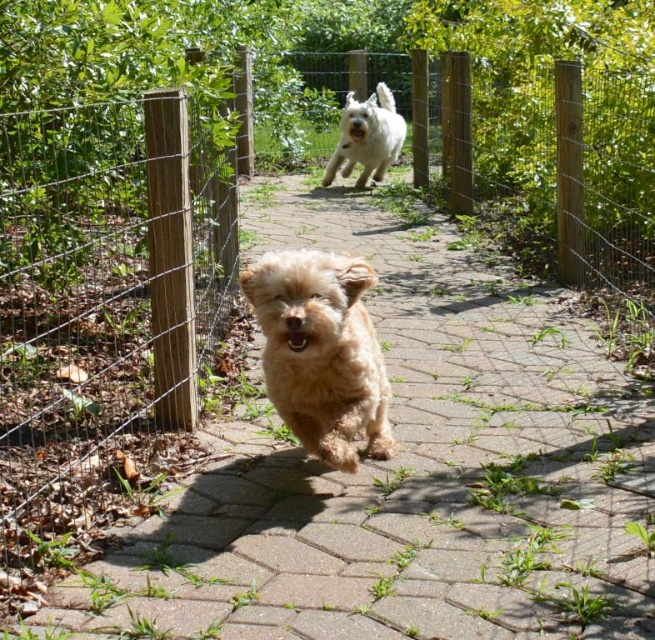
You are standing on the pathway and want to walk from point (117, 456) to point (291, 387). Which direction should you face to move towards the latter point?

To move from point (117, 456) to point (291, 387), you should face towards the background since point (291, 387) is further away from the viewer compared to point (117, 456).

You are a photographer trying to capture a photo of the brown brick path at center and the fuzzy golden dog at center. Based on their positions, which object appears closer to the camera in the image?

The brown brick path at center appears closer to the camera because it is much taller than the fuzzy golden dog at center in the image.

You are a photographer setting up a tripod in the middle of the brown brick path at center. You want to capture the fuzzy golden dog at center as it runs past. Will the tripod block the dog from passing through the path?

The brown brick path at center is bigger than the fuzzy golden dog at center, so the tripod placed in the middle of the path will not block the dog from passing through since there is enough space around the tripod for the dog to move around it.